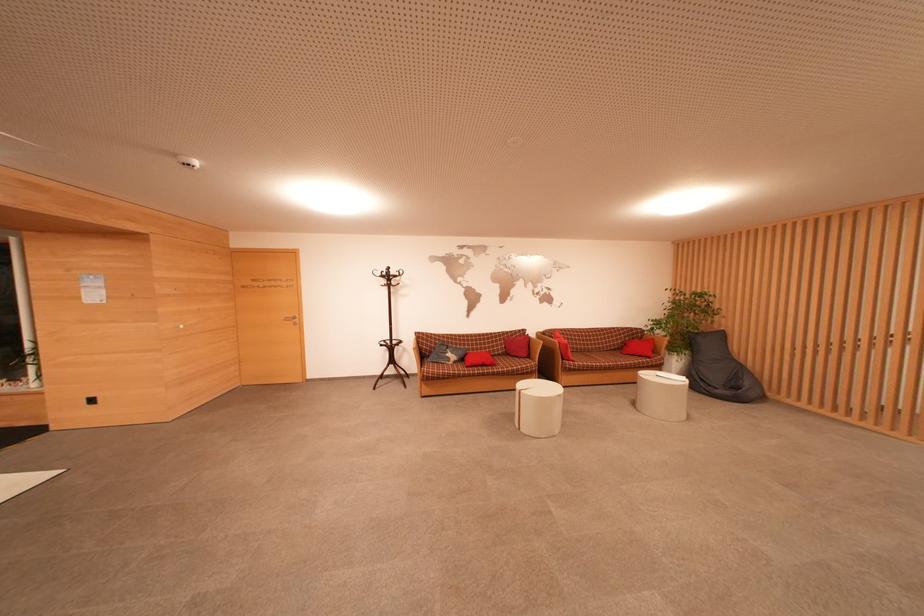
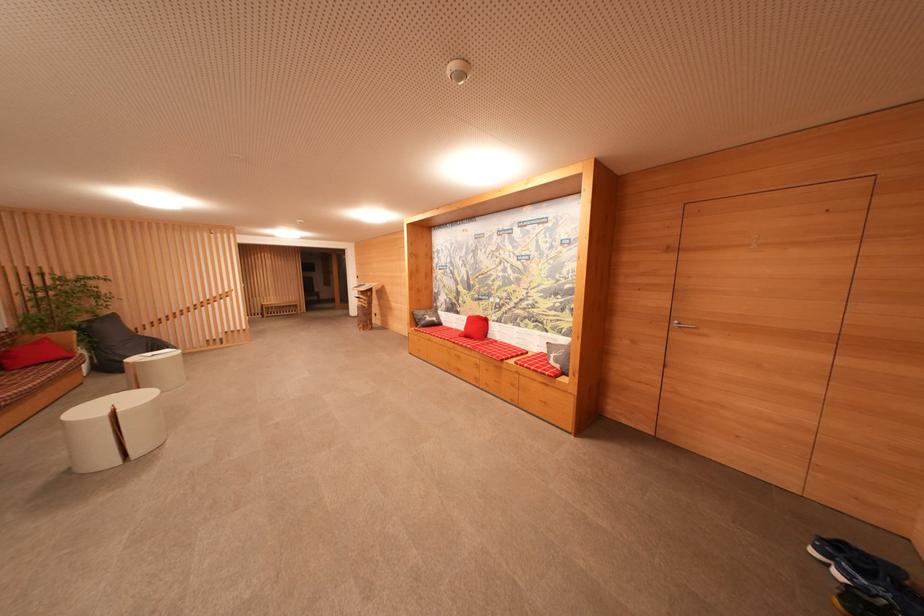
The point at (657, 342) is marked in the first image. Where is the corresponding point in the second image?

(50, 342)